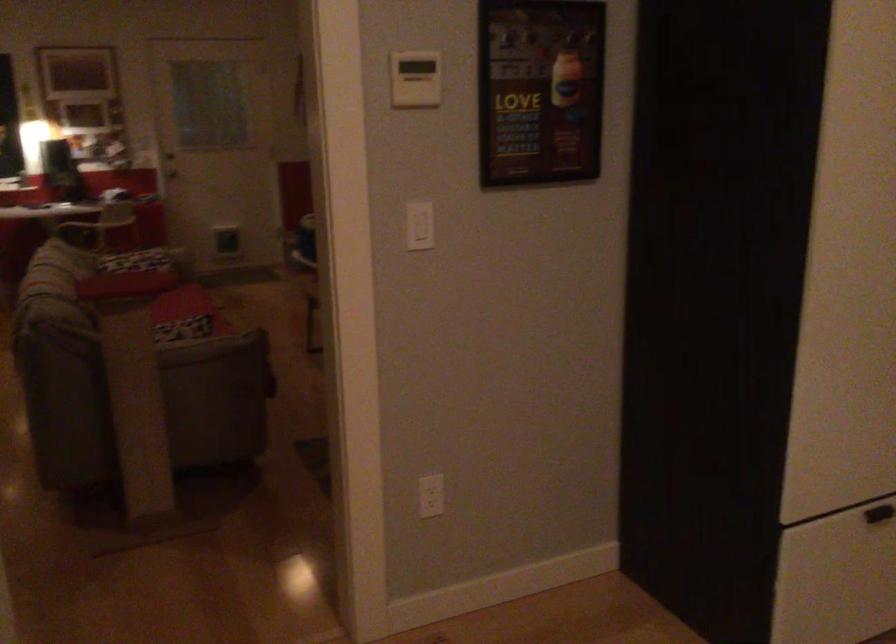
What do you see at coordinates (419, 225) in the screenshot? I see `the white light switch` at bounding box center [419, 225].